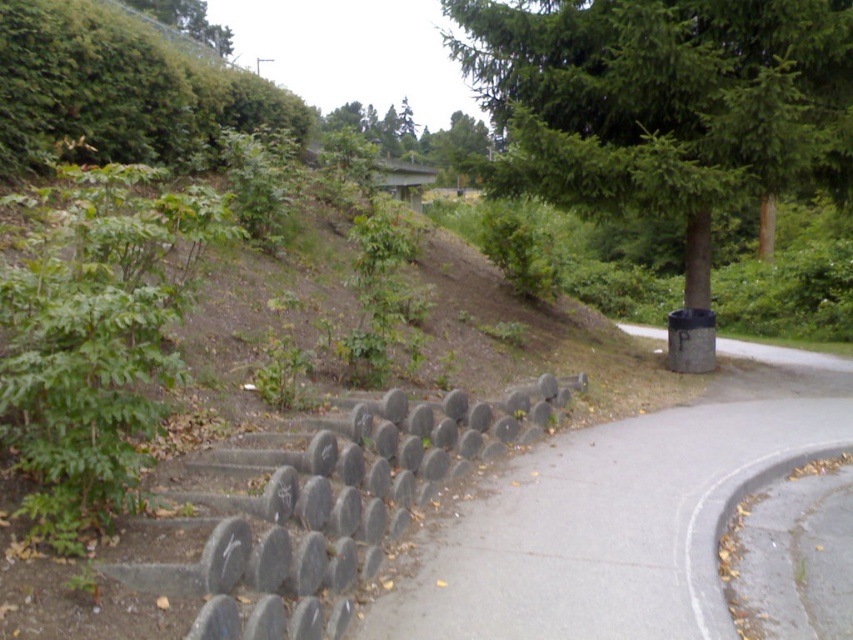
Is gray concrete pavement at lower left closer to the viewer compared to green leafy tree at upper left?

That is True.

Is point (694, 598) in front of point (161, 20)?

Yes.

Identify the location of gray concrete pavement at lower left. This screenshot has width=853, height=640. (619, 515).

Identify the location of gray concrete pavement at lower left. (619, 515).

Is the position of gray concrete pavement at lower left less distant than that of gray concrete barrier at center?

No, it is behind gray concrete barrier at center.

Between gray concrete pavement at lower left and gray concrete barrier at center, which one has more height?

Standing taller between the two is gray concrete barrier at center.

At what (x,y) coordinates should I click in order to perform the action: click on gray concrete pavement at lower left. Please return your answer as a coordinate pair (x, y). This screenshot has height=640, width=853. Looking at the image, I should click on (619, 515).

This screenshot has width=853, height=640. I want to click on gray concrete pavement at lower left, so (619, 515).

Is green textured tree at upper right smaller than gray concrete pavement at lower left?

Result: No, green textured tree at upper right is not smaller than gray concrete pavement at lower left.

Is green textured tree at upper right bigger than gray concrete pavement at lower left?

Indeed, green textured tree at upper right has a larger size compared to gray concrete pavement at lower left.

Identify the location of green textured tree at upper right. (662, 104).